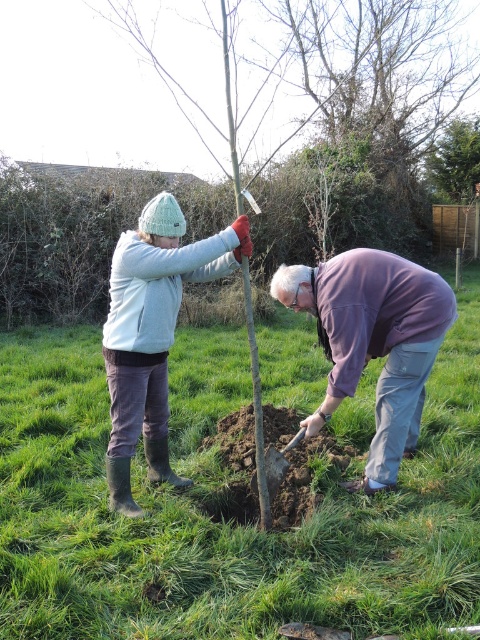
Between green grass at center and green leafy tree at upper center, which one appears on the left side from the viewer's perspective?

green grass at center is more to the left.

From the picture: Which is below, green grass at center or green leafy tree at upper center?

green grass at center is below.

Is point (38, 420) farther from viewer compared to point (451, 131)?

No, it is not.

Image resolution: width=480 pixels, height=640 pixels. I want to click on green grass at center, so click(228, 502).

Who is shorter, matte gray sweater at center or light gray fleece jacket at center?

Standing shorter between the two is matte gray sweater at center.

Between point (388, 304) and point (165, 276), which one is positioned in front?

Point (165, 276) is more forward.

This screenshot has height=640, width=480. Identify the location of matte gray sweater at center. (369, 333).

Is light gray fleece jacket at center shorter than green leafy tree at upper center?

Correct, light gray fleece jacket at center is not as tall as green leafy tree at upper center.

Between point (149, 272) and point (471, 177), which one is positioned in front?

Point (149, 272)

Is point (192, 262) positioned before point (462, 182)?

Yes, it is.

Where is `light gray fleece jacket at center`? light gray fleece jacket at center is located at coordinates (153, 333).